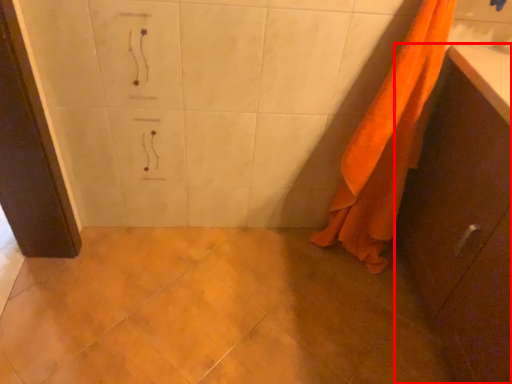
Question: From the image's perspective, what is the correct spatial relationship of bathroom cabinet (annotated by the red box) in relation to towel?

Choices:
 (A) below
 (B) above

Answer: (A)